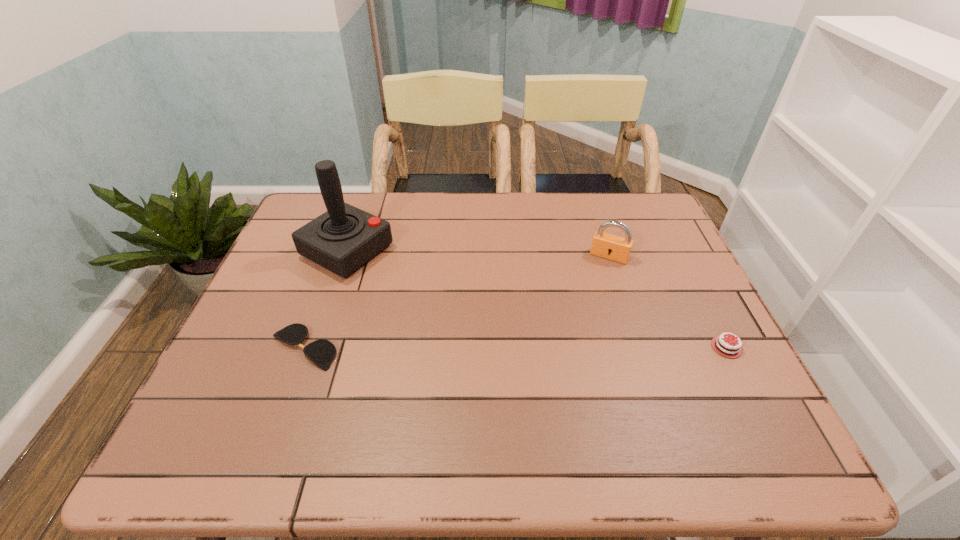
Where is `free area in between the chocolate cake and the third shortest object`? The image size is (960, 540). free area in between the chocolate cake and the third shortest object is located at coordinates pyautogui.click(x=668, y=302).

Find the location of `vacant point located between the spectacles and the joystick`. vacant point located between the spectacles and the joystick is located at coordinates (325, 299).

Find the location of a particular element. Image resolution: width=960 pixels, height=540 pixels. free space between the rightmost object and the joystick is located at coordinates pyautogui.click(x=537, y=299).

This screenshot has height=540, width=960. I want to click on free spot between the rightmost object and the shortest object, so click(x=515, y=347).

Identify the location of vacant area that lies between the tallest object and the spectacles. (325, 299).

Locate an element on the screen. This screenshot has height=540, width=960. vacant point located between the second object from right to left and the second shortest object is located at coordinates (668, 302).

Identify the location of object that is the second closest to the tallest object. This screenshot has width=960, height=540. (608, 246).

Identify which object is located as the nearest to the joystick. Please provide its 2D coordinates. Your answer should be formatted as a tuple, i.e. [(x, y)], where the tuple contains the x and y coordinates of a point satisfying the conditions above.

[(321, 352)]

Locate an element on the screen. free point that satisfies the following two spatial constraints: 1. on the back side of the shortest object; 2. on the right side of the joystick is located at coordinates (339, 251).

The width and height of the screenshot is (960, 540). Identify the location of free space that satisfies the following two spatial constraints: 1. on the front side of the third object from left to right; 2. on the left side of the joystick. (346, 256).